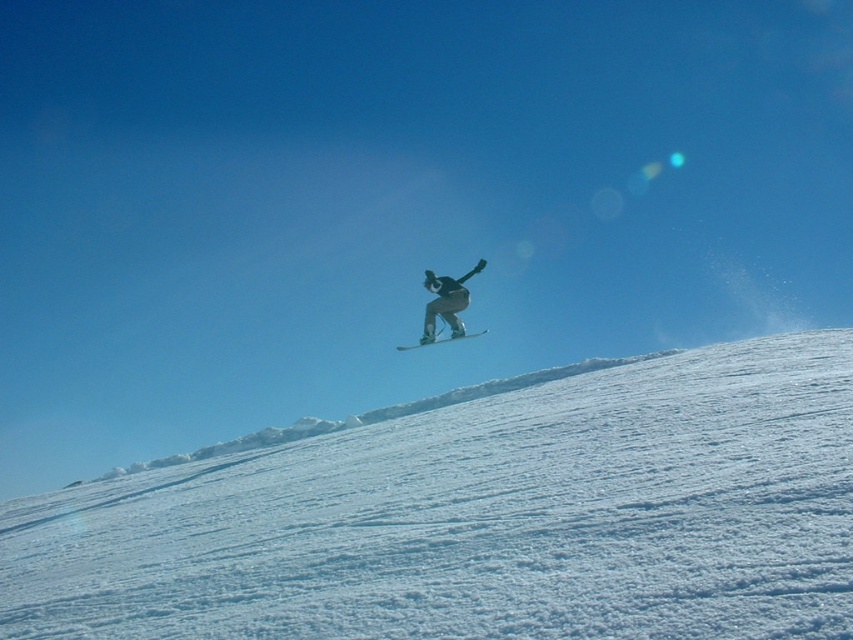
Does black matte snowboarder at center have a greater width compared to white matte snowboard at center?

Indeed, black matte snowboarder at center has a greater width compared to white matte snowboard at center.

Can you confirm if black matte snowboarder at center is bigger than white matte snowboard at center?

Indeed, black matte snowboarder at center has a larger size compared to white matte snowboard at center.

Is point (431, 305) less distant than point (479, 336)?

Yes.

Identify the location of black matte snowboarder at center. This screenshot has height=640, width=853. (445, 307).

Does white powdery snow at center appear on the right side of black matte snowboarder at center?

No, white powdery snow at center is not to the right of black matte snowboarder at center.

You are a GUI agent. You are given a task and a screenshot of the screen. Output one action in this format:
    pyautogui.click(x=<x>, y=<y>)
    Task: Click on the white powdery snow at center
    The width and height of the screenshot is (853, 640).
    Given the screenshot: What is the action you would take?
    pyautogui.click(x=483, y=518)

Between point (96, 602) and point (448, 326), which one is positioned in front?

Point (96, 602) is in front.

You are a GUI agent. You are given a task and a screenshot of the screen. Output one action in this format:
    pyautogui.click(x=<x>, y=<y>)
    Task: Click on the white powdery snow at center
    The width and height of the screenshot is (853, 640).
    Given the screenshot: What is the action you would take?
    pyautogui.click(x=483, y=518)

Is white powdery snow at center taller than white matte snowboard at center?

Indeed, white powdery snow at center has a greater height compared to white matte snowboard at center.

From the picture: Which of these two, white powdery snow at center or white matte snowboard at center, stands shorter?

Standing shorter between the two is white matte snowboard at center.

What do you see at coordinates (483, 518) in the screenshot?
I see `white powdery snow at center` at bounding box center [483, 518].

Locate an element on the screen. white powdery snow at center is located at coordinates (483, 518).